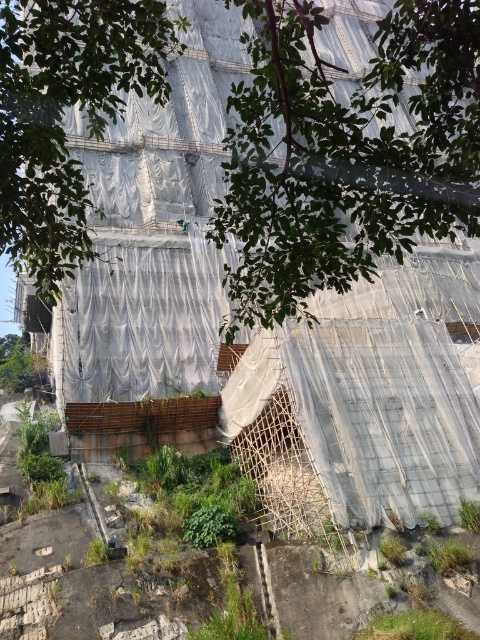
From the picture: You are a worker standing at the base of the green leafy tree at upper center. You need to walk to the green leafy tree at center. How far will you have to walk?

The green leafy tree at upper center is 7.99 meters from green leafy tree at center, so you will have to walk approximately 8 meters to reach it.

You are a construction worker standing at the base of the scaffolding. You notice two points marked on the ground in front of you. The first point is at coordinate point (78, 179) and the second is at coordinate point (47, 38). Which point is closer to your current position?

Point (47, 38) is closer to your current position because it is nearer to the camera compared to point (78, 179), which is further away.

You are standing at the base of the green leafy tree at center and want to walk towards the green leafy tree at upper center. In which direction should you head?

You should head to the right because the green leafy tree at upper center is positioned on the right side of the green leafy tree at center.